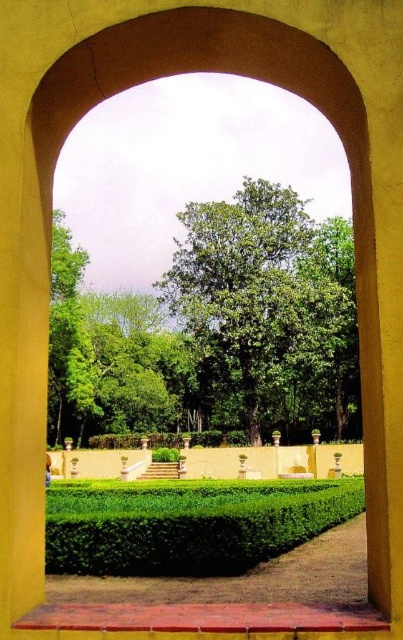
You are planning to place a small bench between the green leafy hedge at center and the green leafy tree at left. Which side of the bench should face the narrower object to ensure it is closer to the narrower one?

The green leafy hedge at center is narrower than the green leafy tree at left. Therefore, the bench should be placed so that its side faces the green leafy hedge at center to be closer to the narrower object.

You are standing at the base of the yellow archway and want to walk towards the green leafy tree at center. However, there is a green leafy tree at left in your path. Based on their positions, can you walk straight ahead without needing to go around the tree?

The green leafy tree at center is located above the green leafy tree at left, meaning it is positioned higher up in the scene. Since you are at the base of the archway, you would first encounter the green leafy tree at left before reaching the one at center. Therefore, you can walk straight ahead as the tree at left is in front and the one at center is behind it, so you won

You are standing at the base of the stairs in the garden and want to reach the raised platform. As you look up, which object, the green leafy tree at center or the green leafy hedge at center, is positioned higher in your line of sight?

The green leafy tree at center is positioned higher in your line of sight than the green leafy hedge at center because it is above it.